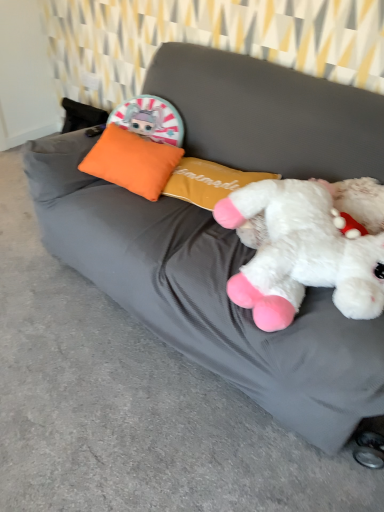
What is the approximate height of orange fabric pillow at upper left?

The height of orange fabric pillow at upper left is 6.82 inches.

What do you see at coordinates (132, 161) in the screenshot?
I see `orange fabric pillow at upper left` at bounding box center [132, 161].

Locate an element on the screen. This screenshot has height=512, width=384. orange fabric pillow at upper left is located at coordinates (132, 161).

At what (x,y) coordinates should I click in order to perform the action: click on white plush toy at right. Please return your answer as a coordinate pair (x, y). Looking at the image, I should click on (298, 253).

Image resolution: width=384 pixels, height=512 pixels. What do you see at coordinates (298, 253) in the screenshot?
I see `white plush toy at right` at bounding box center [298, 253].

At what (x,y) coordinates should I click in order to perform the action: click on orange fabric pillow at upper left. Please return your answer as a coordinate pair (x, y). Image resolution: width=384 pixels, height=512 pixels. Looking at the image, I should click on (132, 161).

Does orange fabric pillow at upper left appear on the left side of white plush toy at right?

Yes.

Is the position of orange fabric pillow at upper left more distant than that of white plush toy at right?

Yes, orange fabric pillow at upper left is further from the viewer.

Is point (133, 141) closer or farther from the camera than point (327, 226)?

Clearly, point (133, 141) is more distant from the camera than point (327, 226).

From the image's perspective, is orange fabric pillow at upper left under white plush toy at right?

Incorrect, from the image's perspective, orange fabric pillow at upper left is higher than white plush toy at right.

From a real-world perspective, is orange fabric pillow at upper left positioned over white plush toy at right based on gravity?

Actually, orange fabric pillow at upper left is physically below white plush toy at right in the real world.

In terms of width, does orange fabric pillow at upper left look wider or thinner when compared to white plush toy at right?

orange fabric pillow at upper left is thinner than white plush toy at right.

Which of these two, orange fabric pillow at upper left or white plush toy at right, stands shorter?

orange fabric pillow at upper left.

Is orange fabric pillow at upper left bigger than white plush toy at right?

No.

Looking at this image, is orange fabric pillow at upper left inside or outside of white plush toy at right?

orange fabric pillow at upper left is spatially situated outside white plush toy at right.

Are orange fabric pillow at upper left and white plush toy at right far apart?

They are positioned close to each other.

Looking at this image, is orange fabric pillow at upper left aimed at white plush toy at right?

No, orange fabric pillow at upper left is not turned towards white plush toy at right.

This screenshot has height=512, width=384. Identify the location of pillow above the white plush toy at right (from the image's perspective). (132, 161).

Considering the positions of objects white plush toy at right and orange fabric pillow at upper left in the image provided, who is more to the right, white plush toy at right or orange fabric pillow at upper left?

white plush toy at right is more to the right.

Does white plush toy at right come in front of orange fabric pillow at upper left?

Yes, white plush toy at right is closer to the camera.

Is point (333, 253) positioned behind point (144, 163)?

No, it is in front of (144, 163).

From the image's perspective, which is above, white plush toy at right or orange fabric pillow at upper left?

orange fabric pillow at upper left, from the image's perspective.

From a real-world perspective, which is physically above, white plush toy at right or orange fabric pillow at upper left?

white plush toy at right.

Which of these two, white plush toy at right or orange fabric pillow at upper left, is thinner?

orange fabric pillow at upper left is thinner.

Based on the photo, is white plush toy at right shorter than orange fabric pillow at upper left?

Result: Incorrect, the height of white plush toy at right does not fall short of that of orange fabric pillow at upper left.

Is white plush toy at right bigger than orange fabric pillow at upper left?

Indeed, white plush toy at right has a larger size compared to orange fabric pillow at upper left.

Is white plush toy at right inside the boundaries of orange fabric pillow at upper left, or outside?

white plush toy at right is not inside orange fabric pillow at upper left, it's outside.

Consider the image. Are white plush toy at right and orange fabric pillow at upper left beside each other?

No, white plush toy at right is not touching orange fabric pillow at upper left.

Is white plush toy at right positioned with its back to orange fabric pillow at upper left?

white plush toy at right is not turned away from orange fabric pillow at upper left.

Where is `toy below the orange fabric pillow at upper left (from the image's perspective)`? The height and width of the screenshot is (512, 384). toy below the orange fabric pillow at upper left (from the image's perspective) is located at coordinates (298, 253).

The image size is (384, 512). In order to click on toy lying on the right of orange fabric pillow at upper left in this screenshot , I will do pos(298,253).

What are the coordinates of `toy that appears in front of the orange fabric pillow at upper left` in the screenshot? It's located at 298,253.